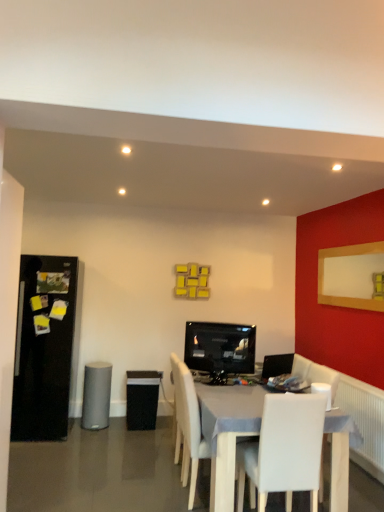
This screenshot has height=512, width=384. I want to click on vacant area that is in front of black mesh speaker at center, the 2th speaker positioned from the left, so click(139, 433).